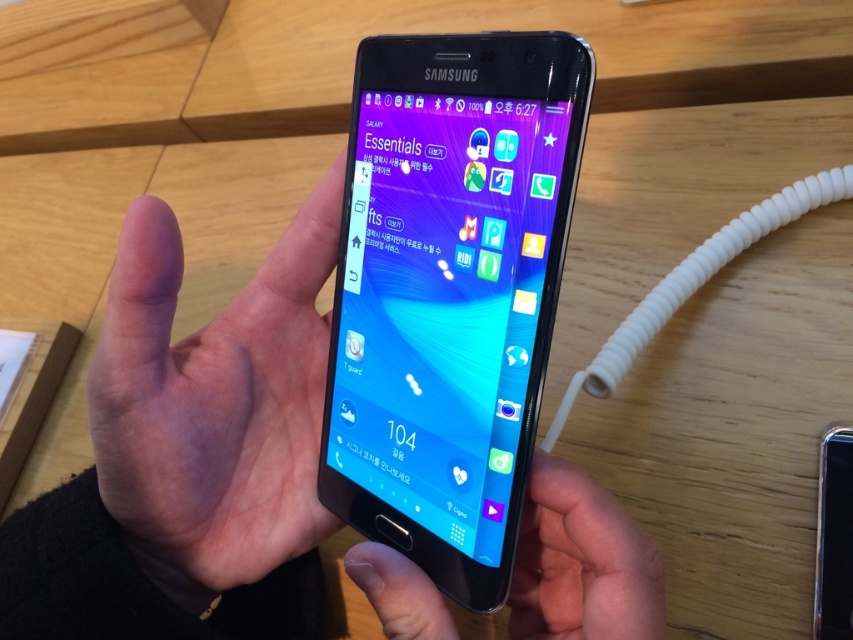
You are a graphic designer who needs to place a sticker on the phone screen. The sticker should be placed exactly at the point with coordinates [189,449]. Can you confirm if this point is on the phone screen?

The point [189,449] is on the black matte phone at center, so yes, the sticker can be placed there as it is on the phone screen.

Where is the black matte phone at center located in the image?

The black matte phone at center is located at point (189, 449).